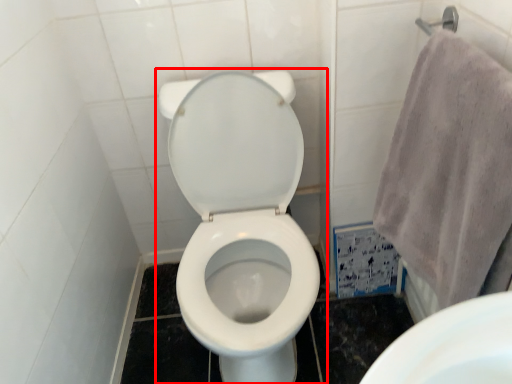
Question: Considering the relative positions of toilet (annotated by the red box) and bath towel in the image provided, where is toilet (annotated by the red box) located with respect to the staircase?

Choices:
 (A) right
 (B) left

Answer: (B)